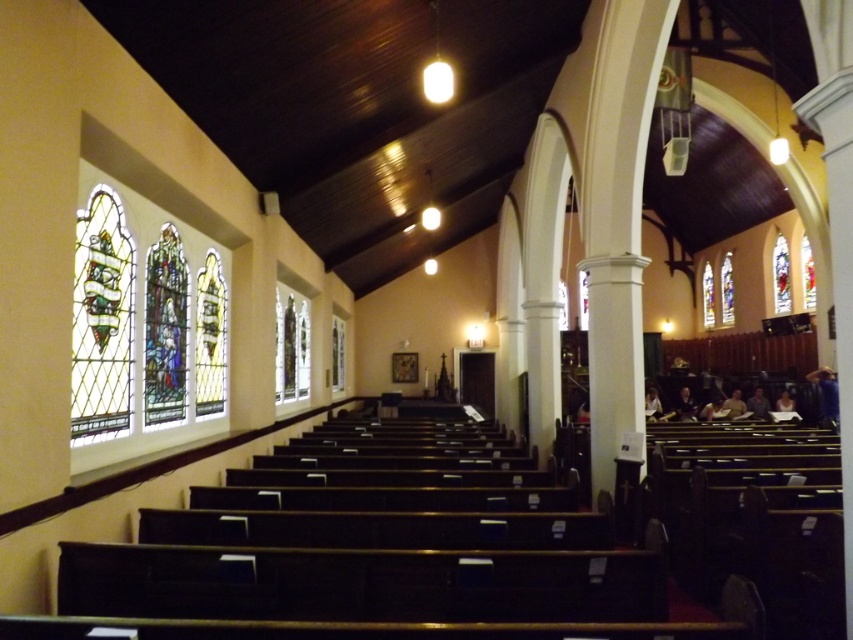
Is stained glass at left above stained glass window at right?

Incorrect, stained glass at left is not positioned above stained glass window at right.

Is point (177, 298) farther from camera compared to point (784, 276)?

No, it is not.

Locate an element on the screen. The image size is (853, 640). stained glass at left is located at coordinates coord(143,321).

What do you see at coordinates (102, 321) in the screenshot? The image size is (853, 640). I see `stained glass window at left` at bounding box center [102, 321].

Identify the location of stained glass window at left. The image size is (853, 640). pyautogui.click(x=102, y=321).

Does point (85, 234) come farther from viewer compared to point (778, 252)?

That is False.

The height and width of the screenshot is (640, 853). Find the location of `stained glass window at left`. stained glass window at left is located at coordinates (102, 321).

Is stained glass at left behind stained glass window at left?

No, it is not.

Describe the element at coordinates (143, 321) in the screenshot. I see `stained glass at left` at that location.

Which is behind, point (177, 356) or point (112, 228)?

The point (177, 356) is more distant.

This screenshot has width=853, height=640. Find the location of `stained glass at left`. stained glass at left is located at coordinates (143, 321).